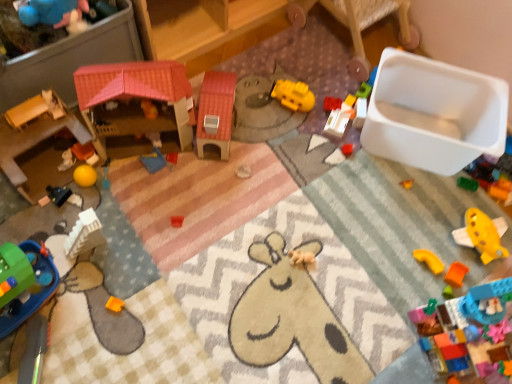
Where is `vacant space behind black plastic toy at lower left, the 13th toy from the right`? The height and width of the screenshot is (384, 512). vacant space behind black plastic toy at lower left, the 13th toy from the right is located at coordinates (72, 163).